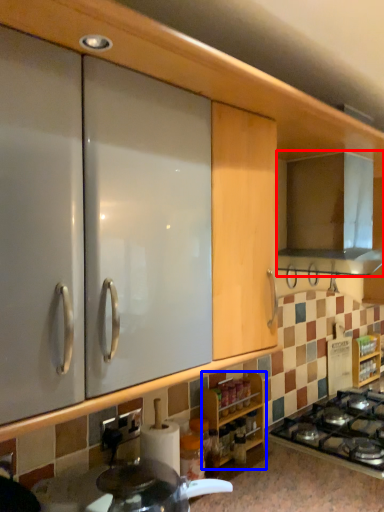
Question: Which object appears farthest to the camera in this image, home appliance (highlighted by a red box) or cabinetry (highlighted by a blue box)?

Choices:
 (A) home appliance
 (B) cabinetry

Answer: (A)